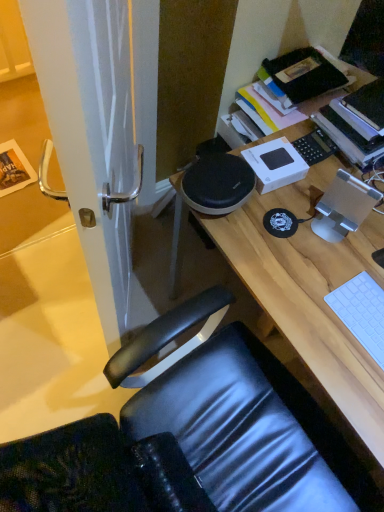
This screenshot has width=384, height=512. Find the location of `vacant space in front of white matte keyboard at lower right`. vacant space in front of white matte keyboard at lower right is located at coordinates (362, 394).